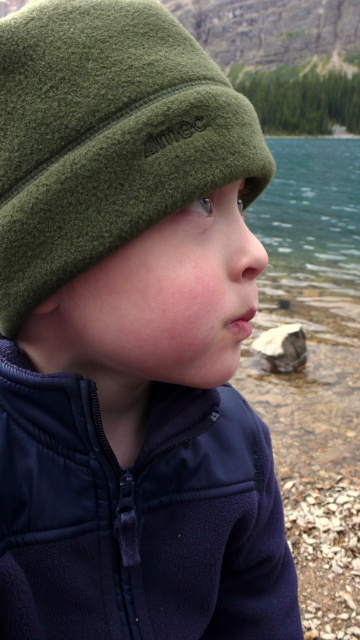
You are a photographer trying to capture the navy fleece jacket at lower right in your shot. The camera you are using has a rectangular viewfinder with coordinates from 0 to 1 on both the x and y axes. If the jacket is located at point 0.808, 0.383, will it be fully visible within the viewfinder?

The navy fleece jacket at lower right is located at point (137, 516). Since the viewfinder spans from 0 to 1 on both axes, the jacket is within the viewfinder as its coordinates are between 0 and 1, so it will be fully visible.

You are a photographer trying to capture the child in the image. You want to focus on the navy fleece jacket at lower right. Where should you position your camera relative to the point marked at coordinate (137, 516) to ensure the jacket is in the center of your shot?

The point at coordinate (137, 516) already marks the location of the navy fleece jacket at lower right. Position your camera directly facing this point to center the jacket in your shot.